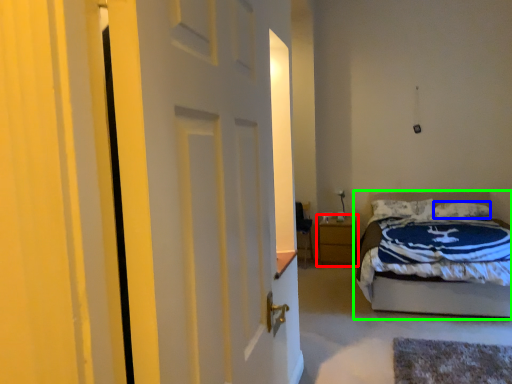
Question: Which object is positioned closest to nightstand (highlighted by a red box)? Select from pillow (highlighted by a blue box) and bed (highlighted by a green box).

Choices:
 (A) pillow
 (B) bed

Answer: (A)